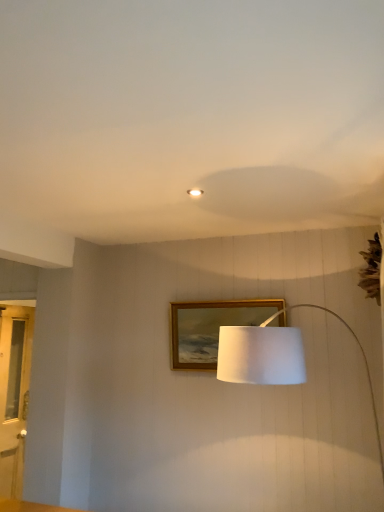
Question: From a real-world perspective, is clear glass door at left located beneath gold wooden picture frame at center?

Choices:
 (A) yes
 (B) no

Answer: (A)

Question: Does clear glass door at left have a lesser height compared to gold wooden picture frame at center?

Choices:
 (A) no
 (B) yes

Answer: (A)

Question: Is clear glass door at left facing away from gold wooden picture frame at center?

Choices:
 (A) no
 (B) yes

Answer: (A)

Question: From a real-world perspective, is clear glass door at left over gold wooden picture frame at center?

Choices:
 (A) no
 (B) yes

Answer: (A)

Question: Is the position of clear glass door at left less distant than that of gold wooden picture frame at center?

Choices:
 (A) yes
 (B) no

Answer: (B)

Question: Is clear glass door at left behind gold wooden picture frame at center?

Choices:
 (A) no
 (B) yes

Answer: (B)

Question: Considering the relative sizes of white fabric lampshade at center and clear glass door at left in the image provided, is white fabric lampshade at center bigger than clear glass door at left?

Choices:
 (A) no
 (B) yes

Answer: (B)

Question: Could you tell me if white fabric lampshade at center is facing clear glass door at left?

Choices:
 (A) no
 (B) yes

Answer: (A)

Question: From the image's perspective, is white fabric lampshade at center below clear glass door at left?

Choices:
 (A) no
 (B) yes

Answer: (A)

Question: Is white fabric lampshade at center outside of clear glass door at left?

Choices:
 (A) yes
 (B) no

Answer: (A)

Question: Is white fabric lampshade at center further to camera compared to clear glass door at left?

Choices:
 (A) no
 (B) yes

Answer: (A)

Question: Can you confirm if white fabric lampshade at center is wider than clear glass door at left?

Choices:
 (A) no
 (B) yes

Answer: (B)

Question: From the image's perspective, is matte white ceiling light at center beneath clear glass door at left?

Choices:
 (A) no
 (B) yes

Answer: (A)